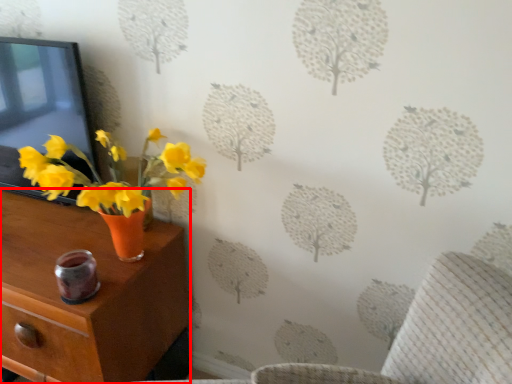
Question: From the image's perspective, what is the correct spatial positioning of nightstand (annotated by the red box) in reference to picture frame?

Choices:
 (A) below
 (B) above

Answer: (A)